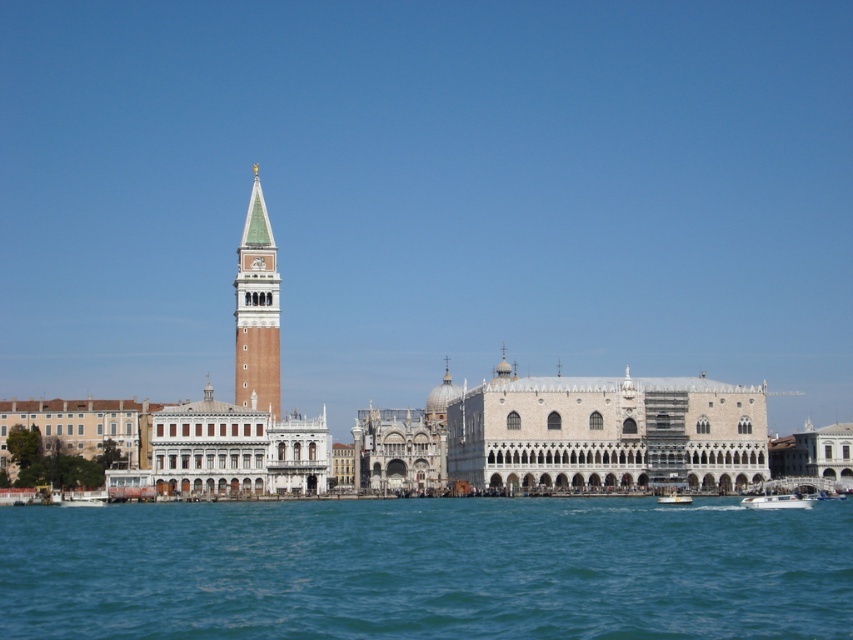
Which is above, white glossy boat at lower right or white plastic boat at lower right?

white plastic boat at lower right

Locate an element on the screen. The image size is (853, 640). white glossy boat at lower right is located at coordinates (776, 500).

The width and height of the screenshot is (853, 640). I want to click on white glossy boat at lower right, so click(776, 500).

Can you confirm if blue water at lower center is positioned above white plastic boat at lower right?

Correct, blue water at lower center is located above white plastic boat at lower right.

Can you confirm if blue water at lower center is smaller than white plastic boat at lower right?

No.

Does point (325, 504) come behind point (674, 493)?

No, it is not.

Image resolution: width=853 pixels, height=640 pixels. Identify the location of blue water at lower center. (426, 570).

Can you confirm if green-tiled bell tower at center-left is thinner than white glossy boat at lower right?

No, green-tiled bell tower at center-left is not thinner than white glossy boat at lower right.

Who is shorter, green-tiled bell tower at center-left or white glossy boat at lower right?

white glossy boat at lower right

Which is behind, point (248, 394) or point (753, 500)?

Positioned behind is point (248, 394).

Where is `green-tiled bell tower at center-left`? green-tiled bell tower at center-left is located at coordinates (256, 310).